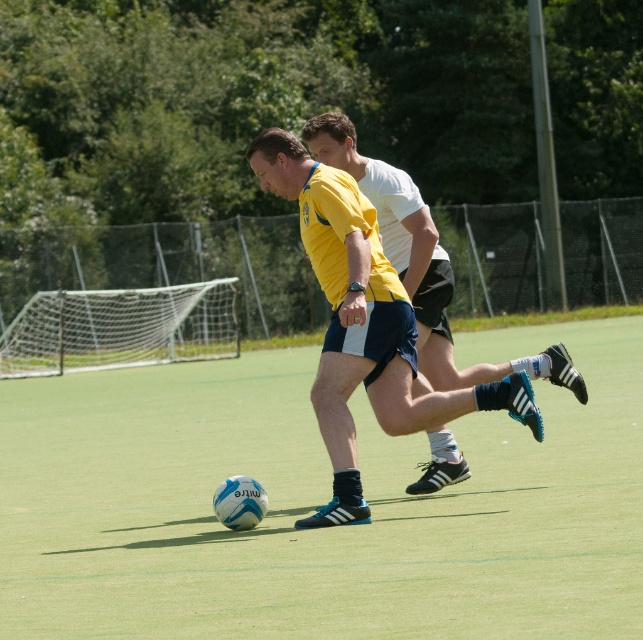
Question: Does green artificial turf at center appear under matte blue shorts at center?

Choices:
 (A) yes
 (B) no

Answer: (A)

Question: Does green artificial turf at center have a lesser width compared to matte blue shorts at center?

Choices:
 (A) yes
 (B) no

Answer: (B)

Question: Is green artificial turf at center to the right of matte blue shorts at center from the viewer's perspective?

Choices:
 (A) no
 (B) yes

Answer: (A)

Question: Which point appears farthest from the camera in this image?

Choices:
 (A) (311, 144)
 (B) (129, 596)

Answer: (A)